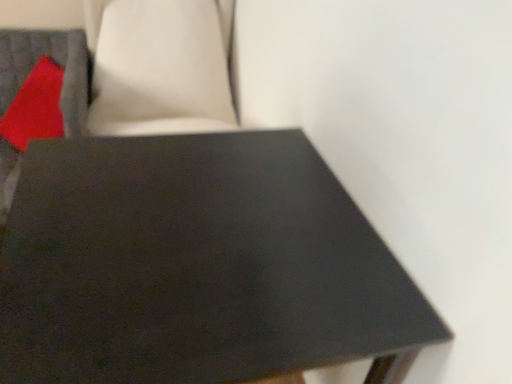
Question: Considering the positions of matte black table at center and matte red pillow at upper left in the image, is matte black table at center wider or thinner than matte red pillow at upper left?

Choices:
 (A) wide
 (B) thin

Answer: (A)

Question: Is point coord(122,268) closer or farther from the camera than point coord(20,148)?

Choices:
 (A) closer
 (B) farther

Answer: (A)

Question: Looking at the image, does matte black table at center seem bigger or smaller compared to matte red pillow at upper left?

Choices:
 (A) big
 (B) small

Answer: (A)

Question: In terms of size, does matte red pillow at upper left appear bigger or smaller than matte black table at center?

Choices:
 (A) small
 (B) big

Answer: (A)

Question: From a real-world perspective, is matte red pillow at upper left above or below matte black table at center?

Choices:
 (A) above
 (B) below

Answer: (A)

Question: Relative to matte black table at center, is matte red pillow at upper left in front or behind?

Choices:
 (A) behind
 (B) front

Answer: (A)

Question: Visually, is matte red pillow at upper left positioned to the left or to the right of matte black table at center?

Choices:
 (A) left
 (B) right

Answer: (A)